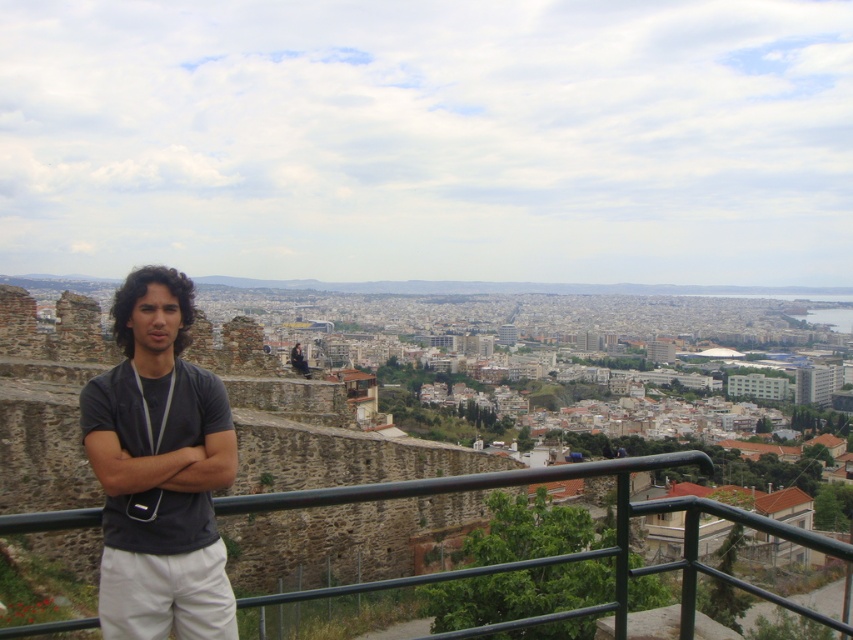
Describe the element at coordinates (160, 468) in the screenshot. I see `dark gray t-shirt at center` at that location.

Can you confirm if dark gray t-shirt at center is positioned to the right of metal/rustic rail at center?

Incorrect, dark gray t-shirt at center is not on the right side of metal/rustic rail at center.

Looking at this image, who is more distant from viewer, (206,416) or (579,472)?

Point (579,472)

Locate an element on the screen. Image resolution: width=853 pixels, height=640 pixels. dark gray t-shirt at center is located at coordinates (160, 468).

Which is behind, point (189, 541) or point (292, 349)?

Point (292, 349)

Does point (111, 308) come in front of point (297, 356)?

Yes, it is.

What are the coordinates of `dark gray t-shirt at center` in the screenshot? It's located at (160, 468).

In order to click on metal/rustic rail at center in this screenshot , I will do `click(554, 556)`.